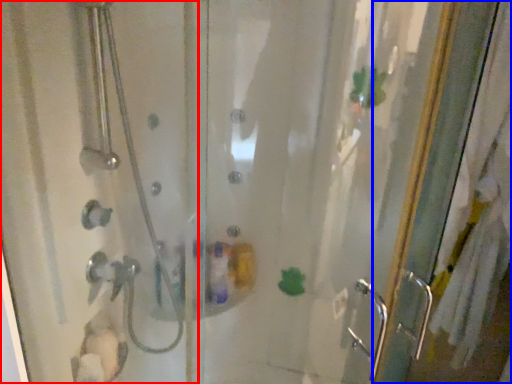
Question: Which of the following is the farthest to the observer, shower door (highlighted by a red box) or screen door (highlighted by a blue box)?

Choices:
 (A) shower door
 (B) screen door

Answer: (B)